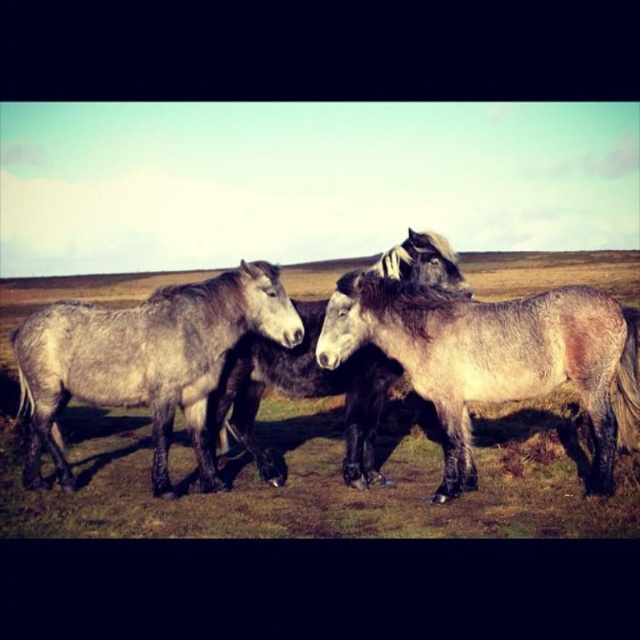
Does gray textured horse at center have a lesser width compared to gray matte horse at center?

No, gray textured horse at center is not thinner than gray matte horse at center.

Who is higher up, gray textured horse at center or gray matte horse at center?

gray textured horse at center

Does point (451, 424) come behind point (368, 352)?

That is False.

Find the location of `gray textured horse at center`. gray textured horse at center is located at coordinates (493, 356).

How much distance is there between gray woolen horse at left and gray matte horse at center?

35.85 inches

Is point (180, 387) farther from camera compared to point (452, 275)?

Yes, it is.

Image resolution: width=640 pixels, height=640 pixels. What are the coordinates of `gray woolen horse at left` in the screenshot? It's located at (145, 360).

Where is `gray textured horse at center`? Image resolution: width=640 pixels, height=640 pixels. gray textured horse at center is located at coordinates pyautogui.click(x=493, y=356).

Does gray textured horse at center appear under gray woolen horse at left?

Yes.

Does point (456, 337) come behind point (45, 308)?

No, (456, 337) is in front of (45, 308).

Where is `gray textured horse at center`? gray textured horse at center is located at coordinates (493, 356).